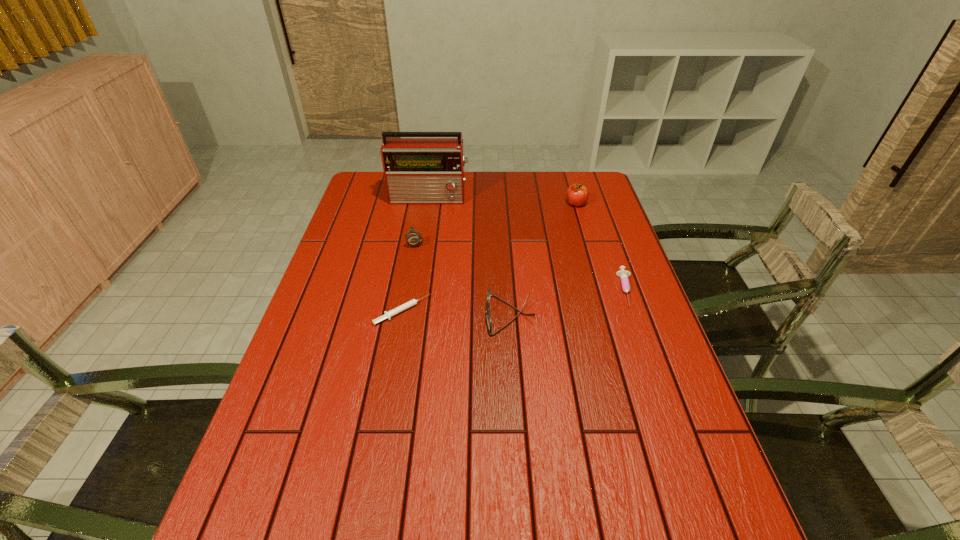
Identify the location of free space that satisfies the following two spatial constraints: 1. on the front-facing side of the right syringe; 2. on the left side of the tallest object. (415, 289).

Identify the location of vacant region that satisfies the following two spatial constraints: 1. on the front-facing side of the fifth tallest object; 2. on the left side of the radio receiver. Image resolution: width=960 pixels, height=540 pixels. (415, 289).

Find the location of a particular element. blank space that satisfies the following two spatial constraints: 1. on the front side of the right syringe; 2. on the front-facing side of the third shortest object is located at coordinates click(636, 315).

The image size is (960, 540). What are the coordinates of `vacant space that satisfies the following two spatial constraints: 1. on the back side of the taller syringe; 2. on the right side of the shorter syringe` in the screenshot? It's located at (406, 289).